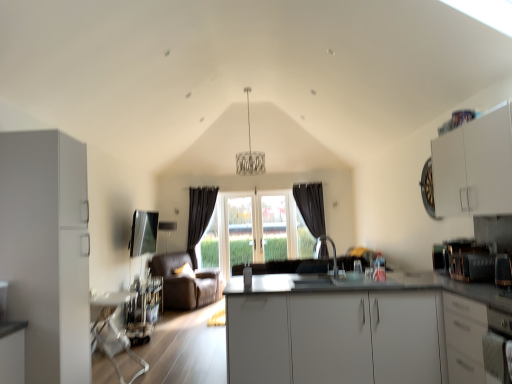
Question: Does white glossy cabinet at right, which is counted as the 2th cabinetry, starting from the left, have a greater height compared to white glossy countertop at center?

Choices:
 (A) yes
 (B) no

Answer: (B)

Question: From the image's perspective, would you say white glossy cabinet at right, the 2th cabinetry when ordered from right to left, is positioned over white glossy countertop at center?

Choices:
 (A) yes
 (B) no

Answer: (A)

Question: Can you confirm if white glossy cabinet at right, the 2th cabinetry when ordered from right to left, is smaller than white glossy countertop at center?

Choices:
 (A) no
 (B) yes

Answer: (B)

Question: From a real-world perspective, is white glossy cabinet at right, the 2th cabinetry when ordered from right to left, over white glossy countertop at center?

Choices:
 (A) yes
 (B) no

Answer: (A)

Question: Can you confirm if white glossy cabinet at right, the 2th cabinetry when ordered from right to left, is bigger than white glossy countertop at center?

Choices:
 (A) yes
 (B) no

Answer: (B)

Question: In terms of width, does transparent glass window at center look wider or thinner when compared to metallic silver toaster at right?

Choices:
 (A) wide
 (B) thin

Answer: (B)

Question: Based on their positions, is transparent glass window at center located to the left or right of metallic silver toaster at right?

Choices:
 (A) left
 (B) right

Answer: (A)

Question: Is transparent glass window at center inside or outside of metallic silver toaster at right?

Choices:
 (A) inside
 (B) outside

Answer: (B)

Question: From the image's perspective, relative to metallic silver toaster at right, is transparent glass window at center above or below?

Choices:
 (A) above
 (B) below

Answer: (B)

Question: From a real-world perspective, is satin silver oven at lower right positioned above or below white matte cabinet at left, acting as the 3th cabinetry starting from the right?

Choices:
 (A) below
 (B) above

Answer: (A)

Question: Considering the positions of satin silver oven at lower right and white matte cabinet at left, the 1th cabinetry from the left, in the image, is satin silver oven at lower right wider or thinner than white matte cabinet at left, the 1th cabinetry from the left,?

Choices:
 (A) thin
 (B) wide

Answer: (A)

Question: Considering the positions of satin silver oven at lower right and white matte cabinet at left, the 1th cabinetry from the left, in the image, is satin silver oven at lower right taller or shorter than white matte cabinet at left, the 1th cabinetry from the left,?

Choices:
 (A) tall
 (B) short

Answer: (B)

Question: Would you say satin silver oven at lower right is inside or outside white matte cabinet at left, the 1th cabinetry from the left?

Choices:
 (A) inside
 (B) outside

Answer: (B)

Question: In the image, is brown leather armchair at center on the left side or the right side of dark grey fabric curtain at center, placed as the first curtain when sorted from right to left?

Choices:
 (A) left
 (B) right

Answer: (A)

Question: From their relative heights in the image, would you say brown leather armchair at center is taller or shorter than dark grey fabric curtain at center, placed as the first curtain when sorted from right to left?

Choices:
 (A) short
 (B) tall

Answer: (A)